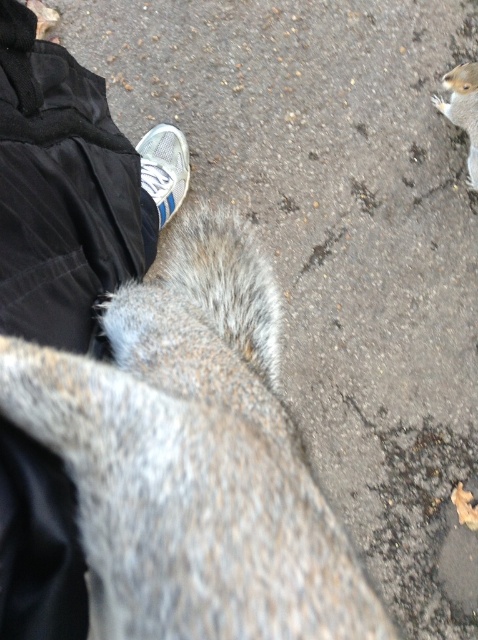
The image size is (478, 640). Find the location of `black fabric shoe at lower left`. black fabric shoe at lower left is located at coordinates (71, 189).

Does white mesh shoe at center have a smaller size compared to gray furry squirrel at upper right?

Incorrect, white mesh shoe at center is not smaller in size than gray furry squirrel at upper right.

Which is below, white mesh shoe at center or gray furry squirrel at upper right?

Positioned lower is white mesh shoe at center.

Measure the distance between point (184, 160) and camera.

Point (184, 160) and camera are 6.74 feet apart from each other.

Locate an element on the screen. white mesh shoe at center is located at coordinates (164, 168).

Between point (86, 305) and point (176, 131), which one is positioned in front?

Point (86, 305) is more forward.

Who is taller, black fabric shoe at lower left or white mesh shoe at center?

black fabric shoe at lower left

Does point (4, 618) come in front of point (159, 184)?

Yes, point (4, 618) is in front of point (159, 184).

The image size is (478, 640). What are the coordinates of `black fabric shoe at lower left` in the screenshot? It's located at coord(71,189).